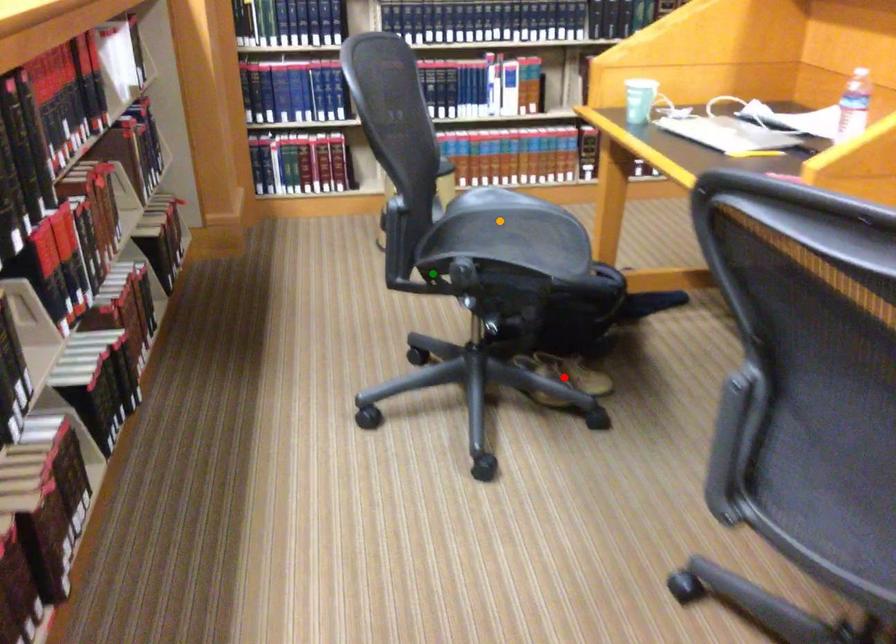
Order these from nearest to farthest:
A) green point
B) orange point
C) red point

red point → orange point → green point